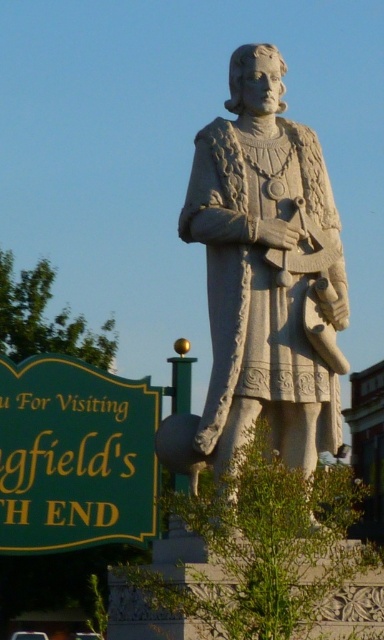
Does white stone statue at center come behind green painted wood sign at lower left?

No, it is not.

Does white stone statue at center have a larger size compared to green painted wood sign at lower left?

Yes, white stone statue at center is bigger than green painted wood sign at lower left.

This screenshot has height=640, width=384. What do you see at coordinates (266, 269) in the screenshot?
I see `white stone statue at center` at bounding box center [266, 269].

This screenshot has height=640, width=384. What are the coordinates of `white stone statue at center` in the screenshot? It's located at 266,269.